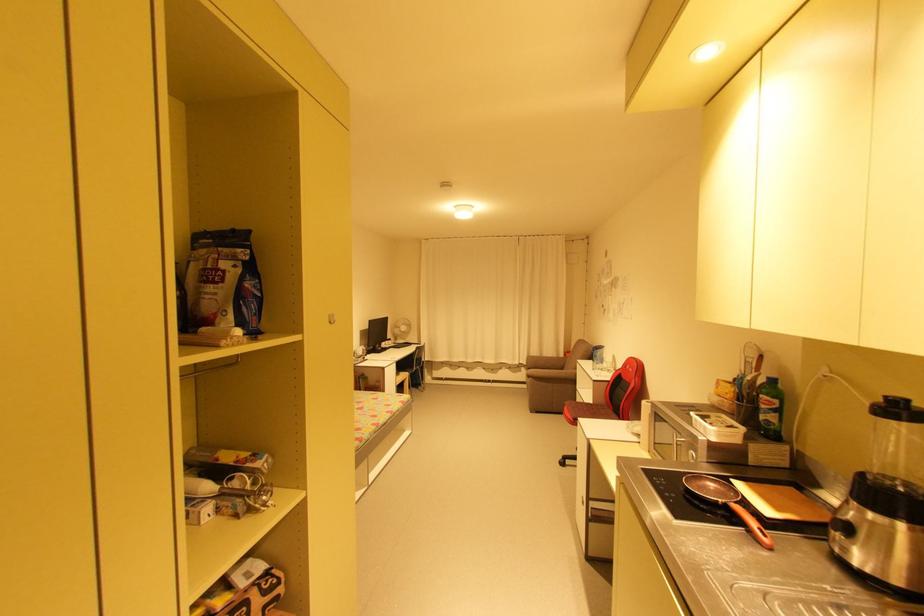
The width and height of the screenshot is (924, 616). What do you see at coordinates (752, 525) in the screenshot? I see `a microwave door handle` at bounding box center [752, 525].